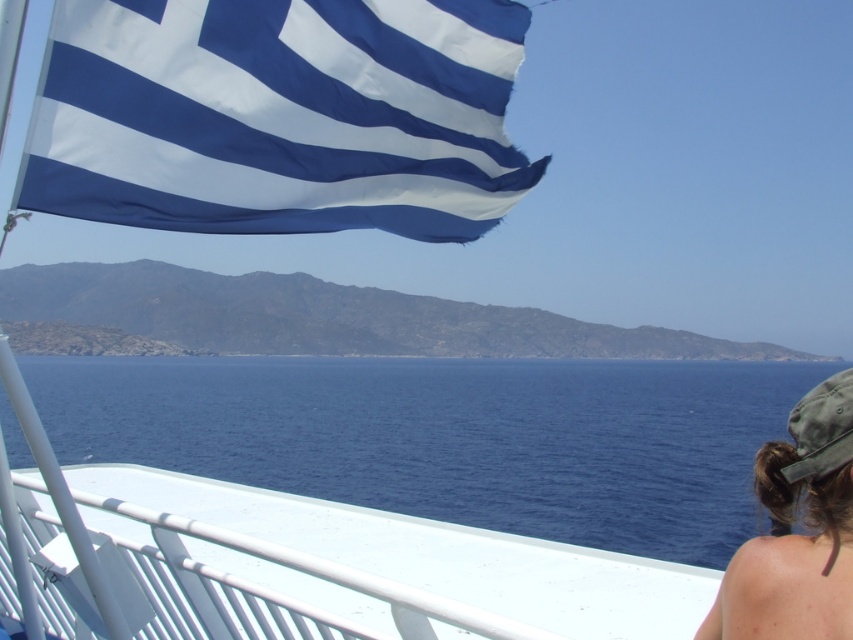
Does point (260, 96) come closer to viewer compared to point (831, 516)?

No, (260, 96) is further to viewer.

Can you confirm if blue fabric flag at upper left is positioned to the right of brown hair at lower right?

Incorrect, blue fabric flag at upper left is not on the right side of brown hair at lower right.

Measure the distance between blue fabric flag at upper left and camera.

blue fabric flag at upper left is 10.66 feet from camera.

The image size is (853, 640). Find the location of `blue fabric flag at upper left`. blue fabric flag at upper left is located at coordinates (277, 115).

Based on the photo, is blue water at lower center wider than brown hair at lower right?

Indeed, blue water at lower center has a greater width compared to brown hair at lower right.

Is point (277, 429) positioned behind point (836, 396)?

Yes, point (277, 429) is farther from viewer.

Does point (351, 397) lie behind point (804, 621)?

Yes, it is behind point (804, 621).

What are the coordinates of `blue water at lower center` in the screenshot? It's located at (451, 436).

In order to click on blue water at lower center in this screenshot , I will do `click(451, 436)`.

What are the coordinates of `blue water at lower center` in the screenshot? It's located at (451, 436).